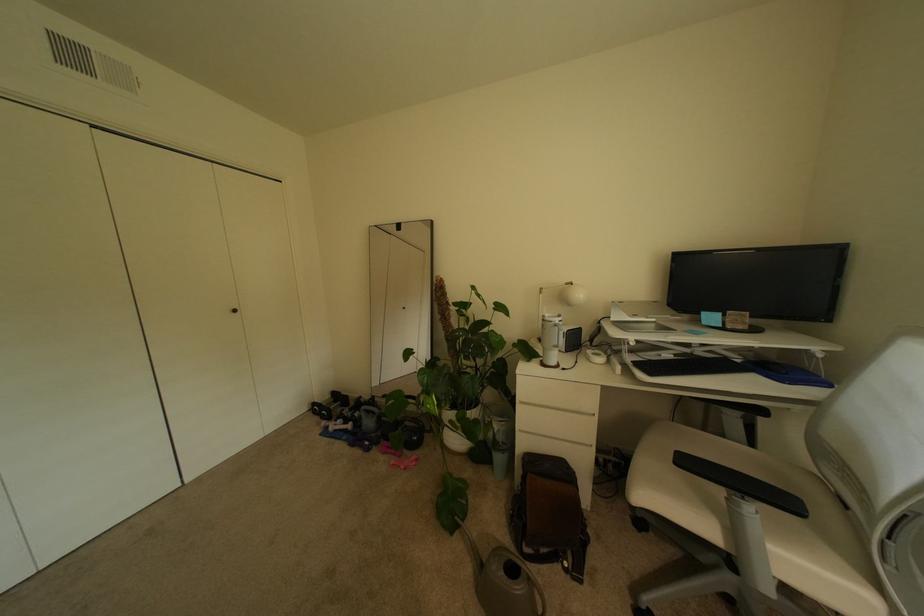
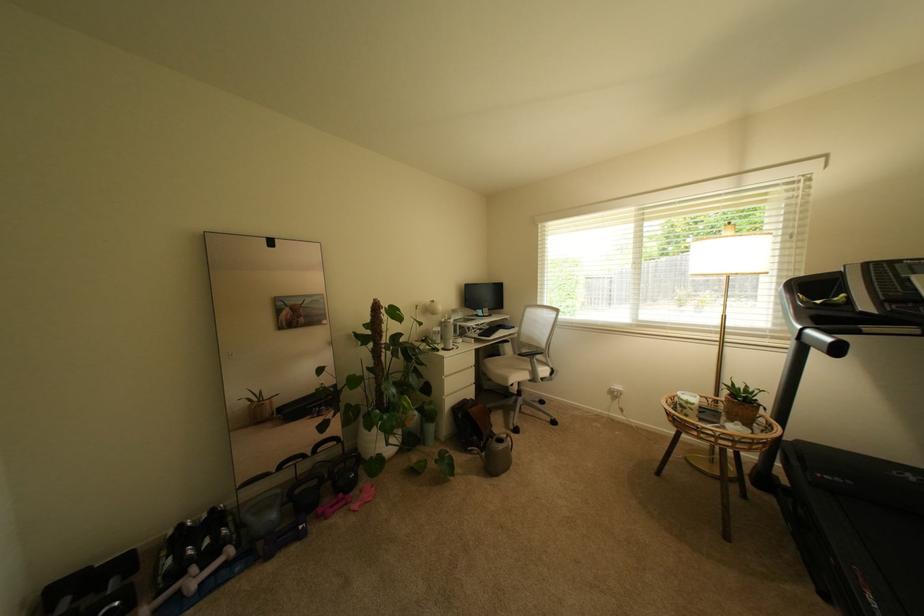
Locate, in the second image, the point that corresponds to point 397,448 in the first image.

(339, 508)